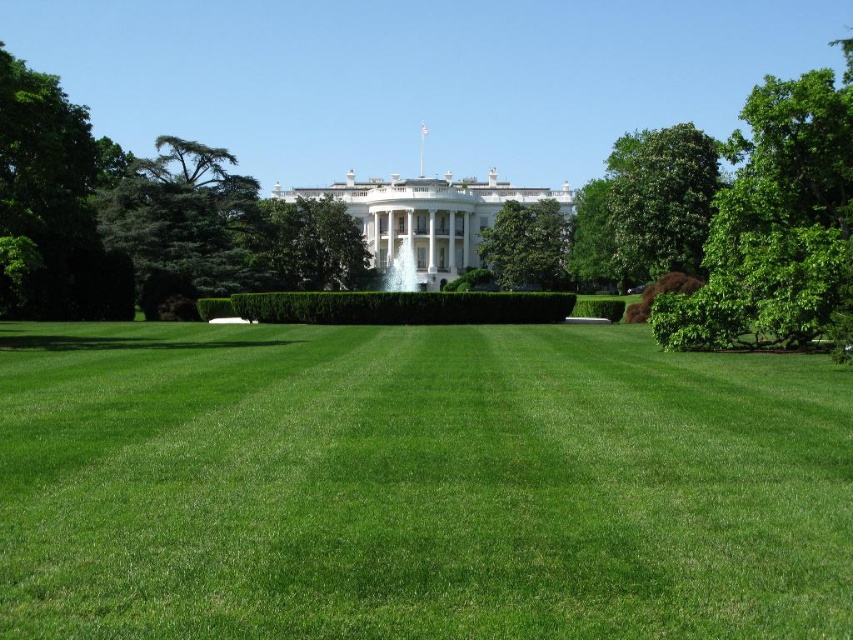
Who is positioned more to the left, green smooth lawn at center or green leafy tree at right?

From the viewer's perspective, green smooth lawn at center appears more on the left side.

What do you see at coordinates (416, 484) in the screenshot?
I see `green smooth lawn at center` at bounding box center [416, 484].

This screenshot has height=640, width=853. Find the location of `green smooth lawn at center`. green smooth lawn at center is located at coordinates (416, 484).

In order to click on green smooth lawn at center in this screenshot , I will do `click(416, 484)`.

Can you confirm if green smooth lawn at center is thinner than green leafy tree at center?

No.

Is point (230, 588) closer to camera compared to point (548, 253)?

Yes, point (230, 588) is closer to viewer.

Does point (749, 440) come closer to viewer compared to point (543, 248)?

Yes, it is in front of point (543, 248).

You are a GUI agent. You are given a task and a screenshot of the screen. Output one action in this format:
    pyautogui.click(x=<x>, y=<y>)
    Task: Click on the green smooth lawn at center
    
    Given the screenshot: What is the action you would take?
    pyautogui.click(x=416, y=484)

Can you confirm if green leafy tree at right is positioned below green leafy hedge at center?

Incorrect, green leafy tree at right is not positioned below green leafy hedge at center.

Who is shorter, green leafy tree at right or green leafy hedge at center?

green leafy hedge at center is shorter.

Which is behind, point (763, 257) or point (412, 307)?

The point (412, 307) is behind.

Locate an element on the screen. green leafy tree at right is located at coordinates (776, 227).